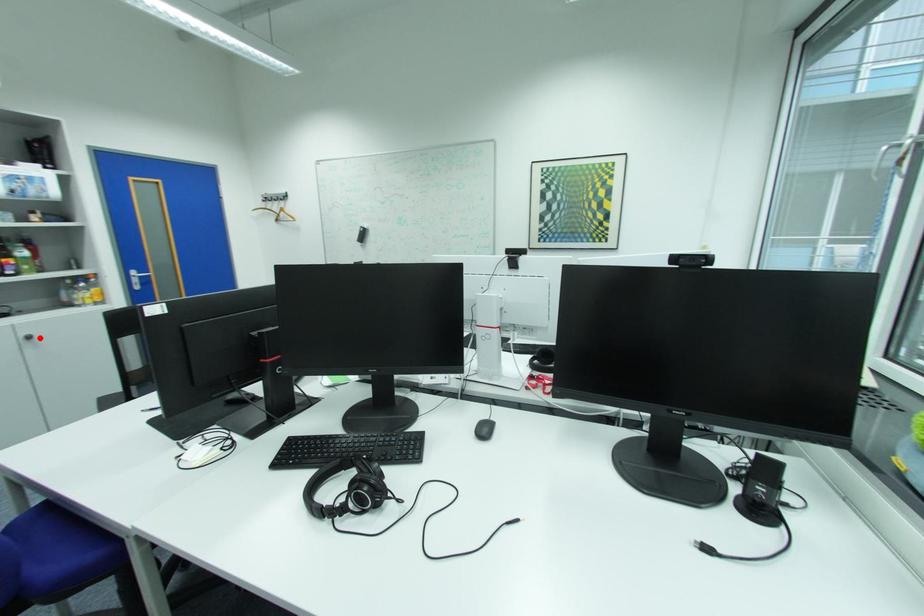
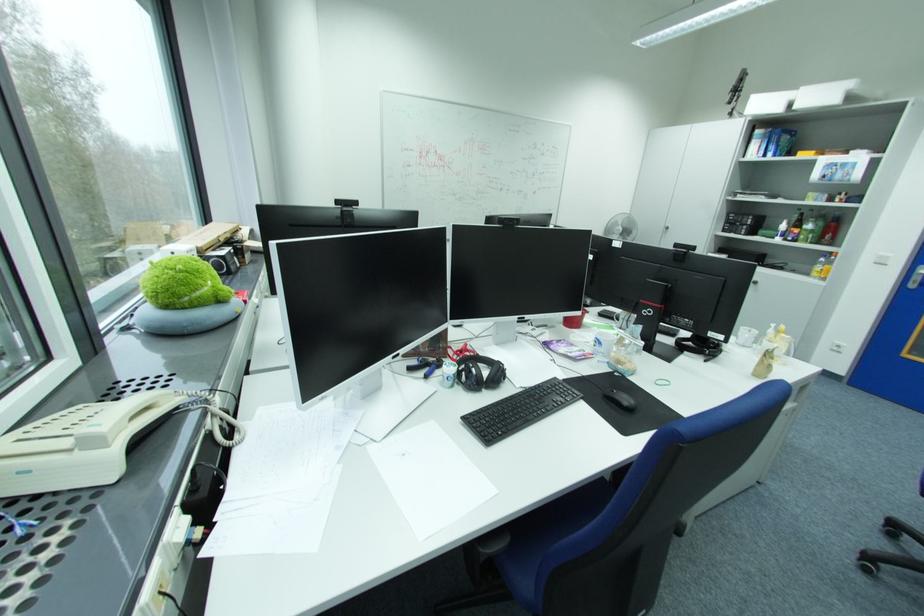
Locate, in the second image, the point that corresponds to the highlighted location in the first image.

(763, 283)